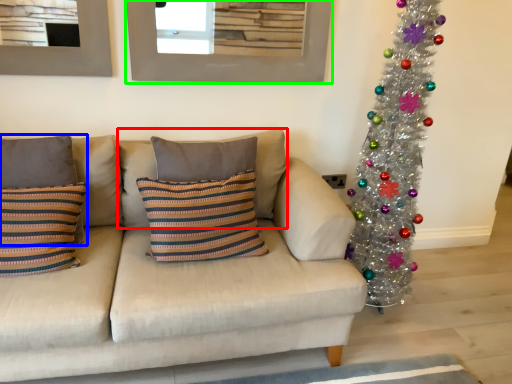
Question: Considering the real-world distances, which object is closest to pillow (highlighted by a red box)? pillow (highlighted by a blue box) or picture frame (highlighted by a green box).

Choices:
 (A) pillow
 (B) picture frame

Answer: (A)